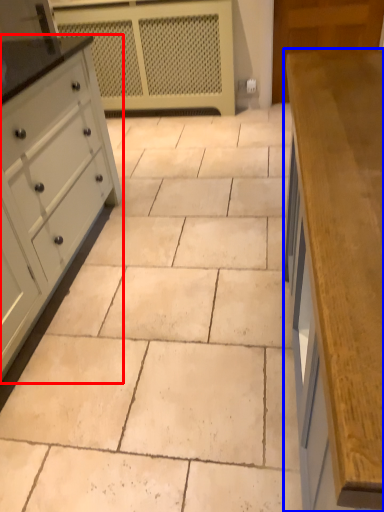
Question: Which object is further to the camera taking this photo, chest of drawers (highlighted by a red box) or countertop (highlighted by a blue box)?

Choices:
 (A) chest of drawers
 (B) countertop

Answer: (A)